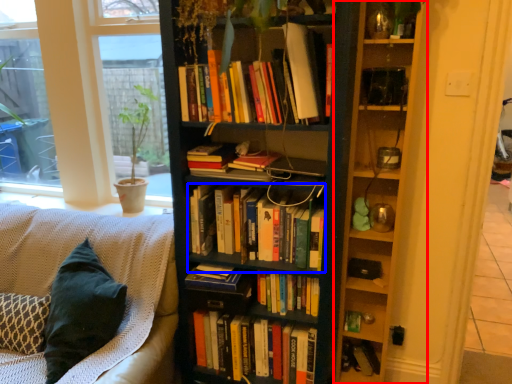
Question: Which of the following is the closest to the observer, shelf (highlighted by a red box) or book (highlighted by a blue box)?

Choices:
 (A) shelf
 (B) book

Answer: (A)